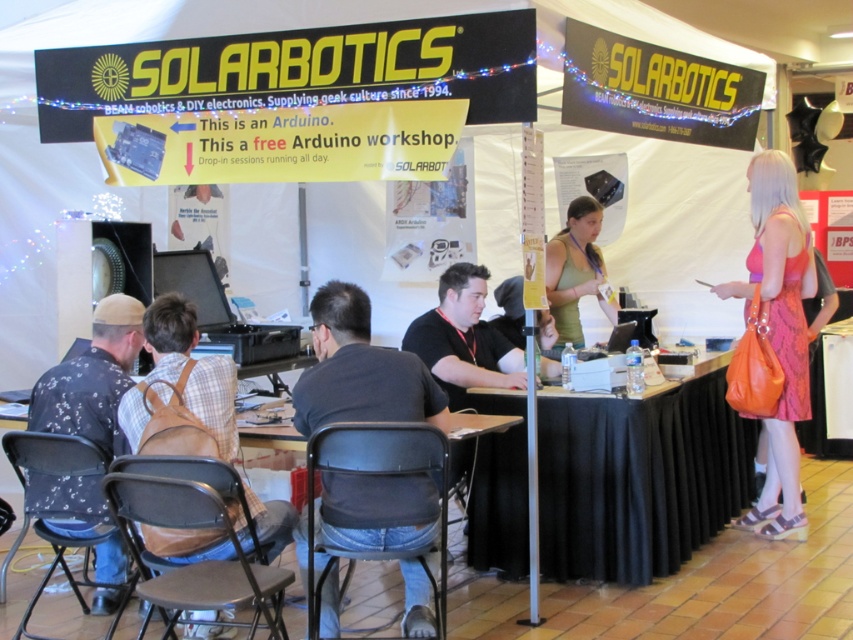
You are at the tech event and need to sit down. There is a black plastic chair at center. Can you estimate its location relative to the table?

The black plastic chair at center is located at point 0.705 on the x axis and 0.447 on the y axis relative to the table.

You are at the tech event and need to sit down. There is a black plastic chair at center and a green matte shirt at upper center. Which object is closer to your current position if you are facing the scene?

The black plastic chair at center is closer to your current position because it is to the left of the green matte shirt at upper center, which is further away in the upper area.

You are organizing a small tech workshop and need to place a brown leather backpack at lower left and a black plastic table at center. Based on the scene description, can the backpack fit on the table without hanging over the edges?

The brown leather backpack at lower left might be wider than the black plastic table at center, so there is a possibility that the backpack would hang over the edges of the table.